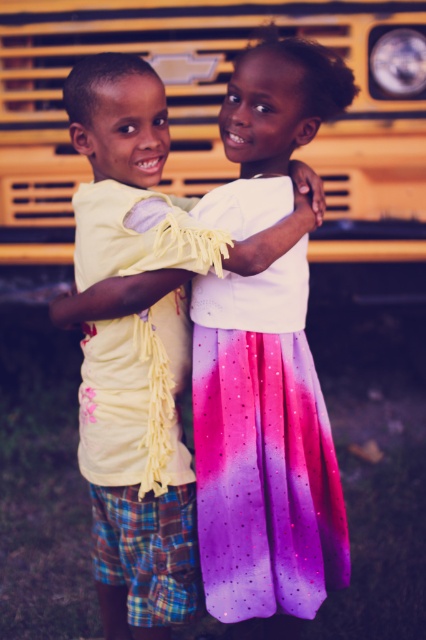
Question: Is matte yellow shirt at center smaller than shiny ombre skirt at center?

Choices:
 (A) yes
 (B) no

Answer: (B)

Question: Which of the following is the farthest from the observer?

Choices:
 (A) matte yellow shirt at center
 (B) shiny ombre skirt at center

Answer: (B)

Question: Does matte yellow shirt at center have a greater width compared to shiny ombre skirt at center?

Choices:
 (A) yes
 (B) no

Answer: (A)

Question: Which point is closer to the camera?

Choices:
 (A) matte yellow shirt at center
 (B) shiny ombre skirt at center

Answer: (A)

Question: Which of the following is the closest to the observer?

Choices:
 (A) (264, 518)
 (B) (279, 536)

Answer: (A)

Question: Can you confirm if matte yellow shirt at center is positioned to the right of shiny ombre skirt at center?

Choices:
 (A) no
 (B) yes

Answer: (A)